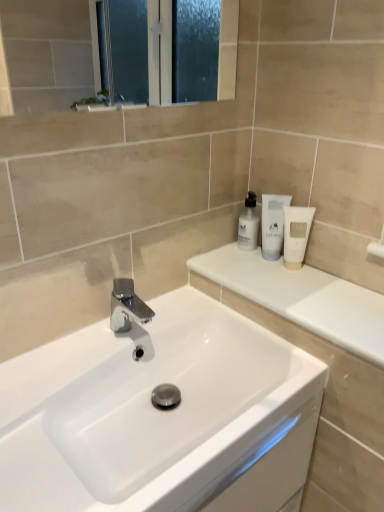
Question: Considering the relative sizes of white matte tube at upper right, placed as the first toiletry when sorted from right to left, and white glossy lotion at upper right, which ranks as the 1th toiletry in left-to-right order, in the image provided, is white matte tube at upper right, placed as the first toiletry when sorted from right to left, bigger than white glossy lotion at upper right, which ranks as the 1th toiletry in left-to-right order,?

Choices:
 (A) no
 (B) yes

Answer: (A)

Question: Is the depth of white matte tube at upper right, placed as the first toiletry when sorted from right to left, greater than that of white glossy lotion at upper right, which ranks as the 1th toiletry in left-to-right order?

Choices:
 (A) yes
 (B) no

Answer: (B)

Question: Are white matte tube at upper right, the third toiletry viewed from the left, and white glossy lotion at upper right, positioned as the third toiletry in right-to-left order, located far from each other?

Choices:
 (A) no
 (B) yes

Answer: (A)

Question: Considering the relative sizes of white matte tube at upper right, the third toiletry viewed from the left, and white glossy lotion at upper right, which ranks as the 1th toiletry in left-to-right order, in the image provided, is white matte tube at upper right, the third toiletry viewed from the left, smaller than white glossy lotion at upper right, which ranks as the 1th toiletry in left-to-right order,?

Choices:
 (A) no
 (B) yes

Answer: (B)

Question: Is white matte tube at upper right, placed as the first toiletry when sorted from right to left, oriented towards white glossy lotion at upper right, positioned as the third toiletry in right-to-left order?

Choices:
 (A) yes
 (B) no

Answer: (B)

Question: From the image's perspective, does white matte tube at upper right, the third toiletry viewed from the left, appear higher than white glossy lotion at upper right, positioned as the third toiletry in right-to-left order?

Choices:
 (A) yes
 (B) no

Answer: (B)

Question: Does white glossy countertop at upper right have a lesser width compared to white glossy lotion at upper right, positioned as the third toiletry in right-to-left order?

Choices:
 (A) yes
 (B) no

Answer: (B)

Question: From the image's perspective, is white glossy countertop at upper right located beneath white glossy lotion at upper right, which ranks as the 1th toiletry in left-to-right order?

Choices:
 (A) yes
 (B) no

Answer: (A)

Question: Is white glossy countertop at upper right bigger than white glossy lotion at upper right, positioned as the third toiletry in right-to-left order?

Choices:
 (A) no
 (B) yes

Answer: (B)

Question: From the image's perspective, is white glossy countertop at upper right over white glossy lotion at upper right, positioned as the third toiletry in right-to-left order?

Choices:
 (A) no
 (B) yes

Answer: (A)

Question: Is white glossy countertop at upper right taller than white glossy lotion at upper right, positioned as the third toiletry in right-to-left order?

Choices:
 (A) yes
 (B) no

Answer: (B)

Question: Considering the relative positions of white glossy countertop at upper right and white glossy lotion at upper right, positioned as the third toiletry in right-to-left order, in the image provided, is white glossy countertop at upper right to the right of white glossy lotion at upper right, positioned as the third toiletry in right-to-left order, from the viewer's perspective?

Choices:
 (A) no
 (B) yes

Answer: (B)

Question: From the image's perspective, is white matte tube at upper right, placed as the first toiletry when sorted from right to left, above white glossy sink at center?

Choices:
 (A) no
 (B) yes

Answer: (B)